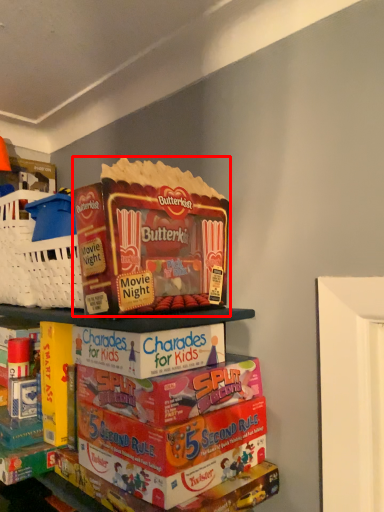
Question: Observing the image, what is the correct spatial positioning of product (annotated by the red box) in reference to shelf?

Choices:
 (A) left
 (B) right

Answer: (A)